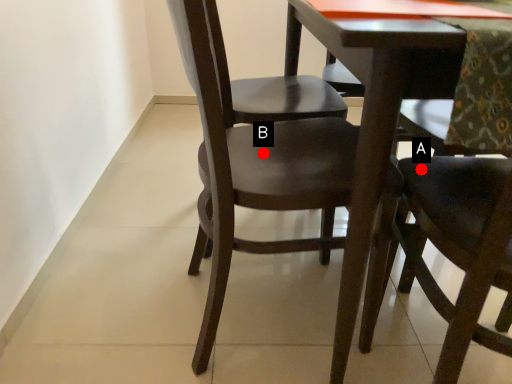
Question: Two points are circled on the image, labeled by A and B beside each circle. Which point is closer to the camera?

Choices:
 (A) A is closer
 (B) B is closer

Answer: (A)